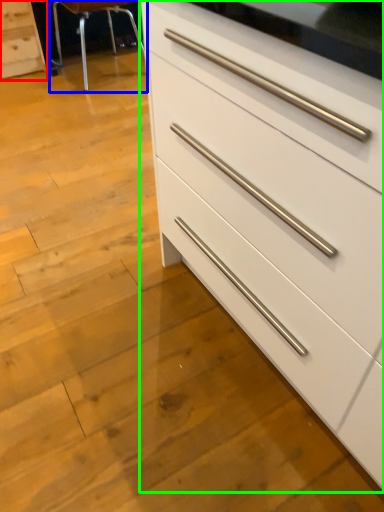
Question: Based on their relative distances, which object is nearer to chest of drawers (highlighted by a red box)? Choose from bar stool (highlighted by a blue box) and chest of drawers (highlighted by a green box).

Choices:
 (A) bar stool
 (B) chest of drawers

Answer: (A)